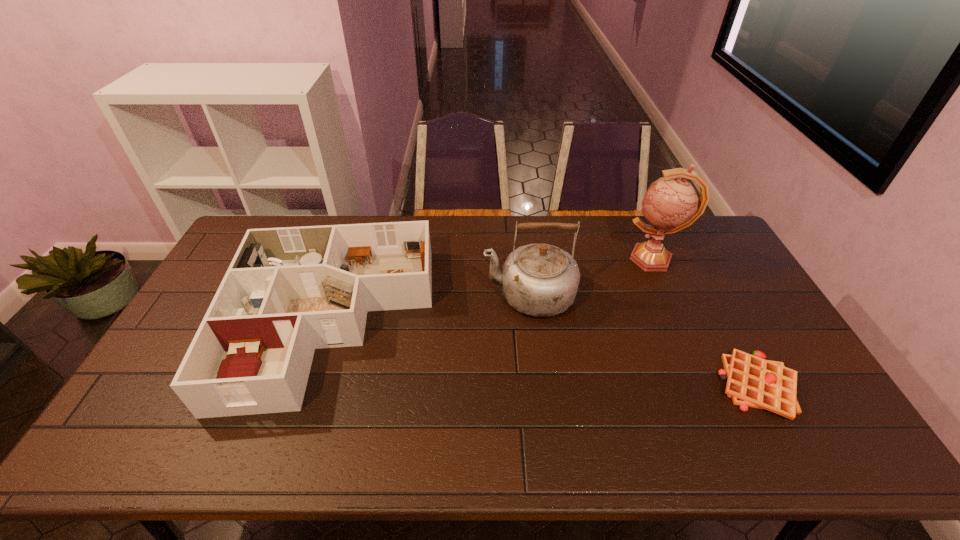
I want to click on free space at the near edge of the desktop, so click(278, 435).

The width and height of the screenshot is (960, 540). In the image, there is a desktop. Find the location of `free space at the left edge`. free space at the left edge is located at coordinates (174, 351).

The width and height of the screenshot is (960, 540). Find the location of `vacant space at the far left corner of the desktop`. vacant space at the far left corner of the desktop is located at coordinates (250, 224).

Find the location of a particular element. The image size is (960, 540). free space between the kettle and the tallest object is located at coordinates (591, 277).

Where is `unoccupied area between the third tallest object and the third object from right to left`? unoccupied area between the third tallest object and the third object from right to left is located at coordinates (429, 308).

This screenshot has height=540, width=960. What are the coordinates of `free space between the dollhouse and the second tallest object` in the screenshot? It's located at (429, 308).

At what (x,y) coordinates should I click in order to perform the action: click on free spot between the waffle and the third object from right to left. Please return your answer as a coordinate pair (x, y). Looking at the image, I should click on (643, 341).

Find the location of a particular element. The height and width of the screenshot is (540, 960). empty location between the second tallest object and the second shortest object is located at coordinates (429, 308).

Where is `vacant space in between the tallest object and the waffle`? vacant space in between the tallest object and the waffle is located at coordinates (706, 322).

Locate an element on the screen. The height and width of the screenshot is (540, 960). free space between the second shortest object and the waffle is located at coordinates point(543,354).